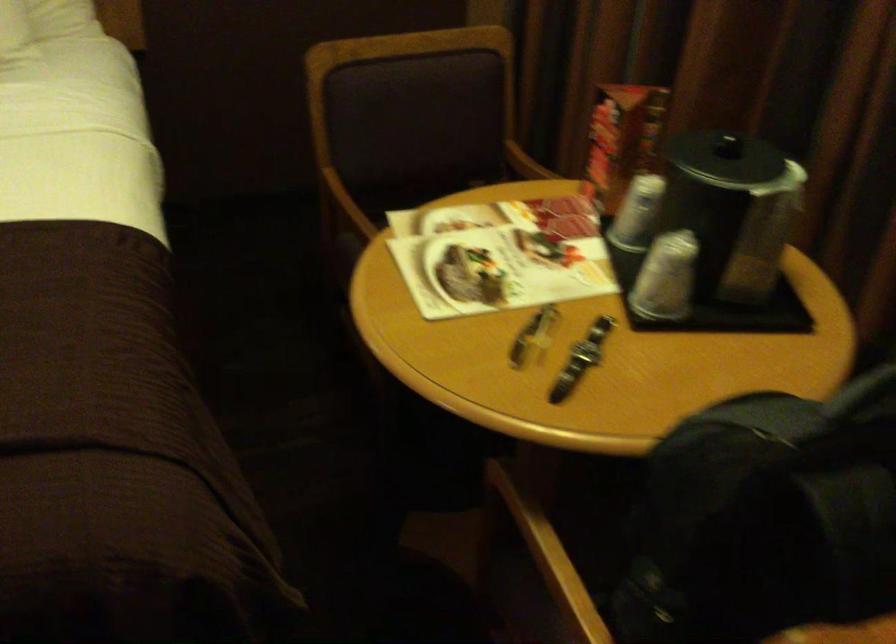
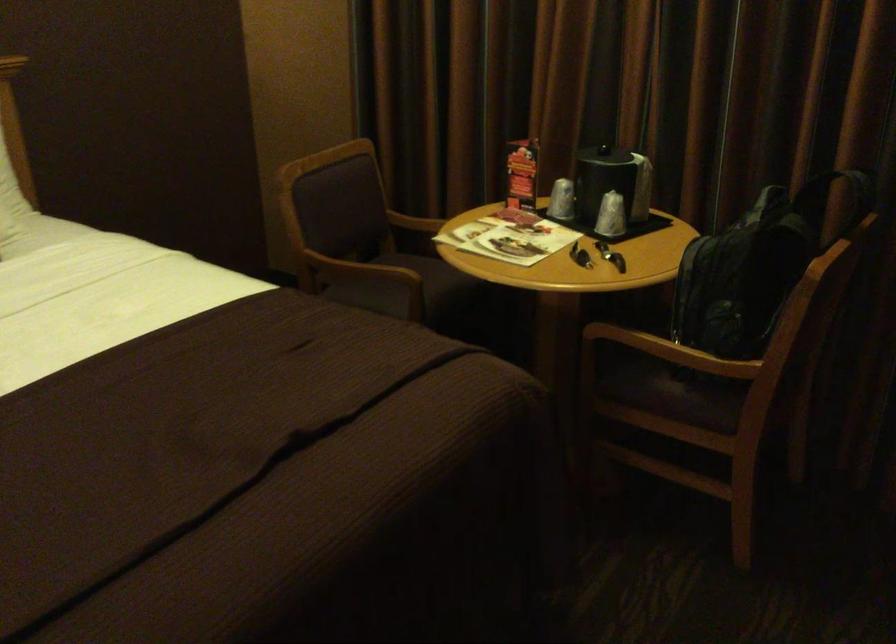
In the second image, find the point that corresponds to point 630,216 in the first image.

(561, 200)